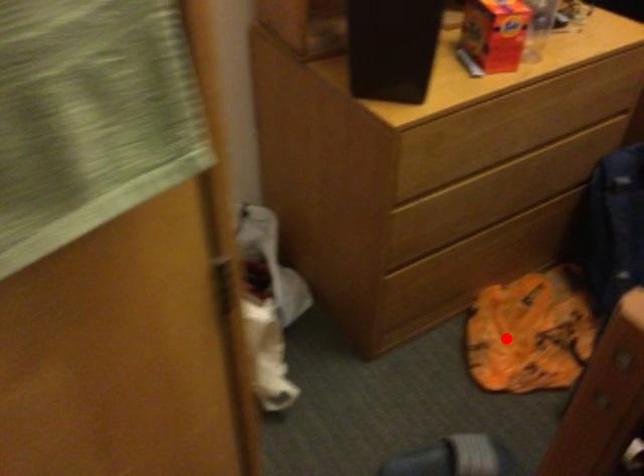
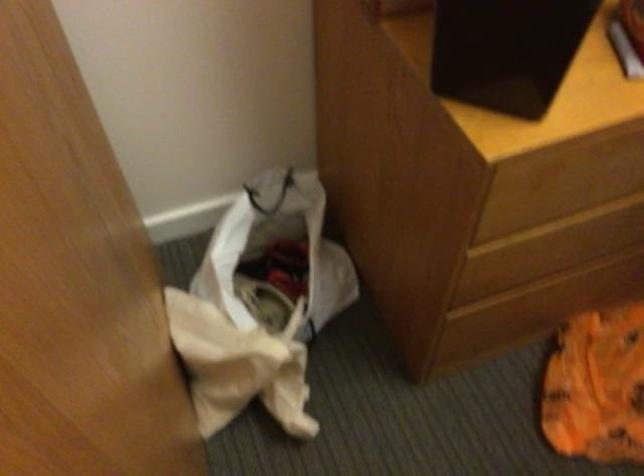
Question: I am providing you with two images of the same scene from different viewpoints. A red point is shown in image1. For the corresponding object point in image2, is it positioned nearer or farther from the camera?

Choices:
 (A) Nearer
 (B) Farther

Answer: (A)